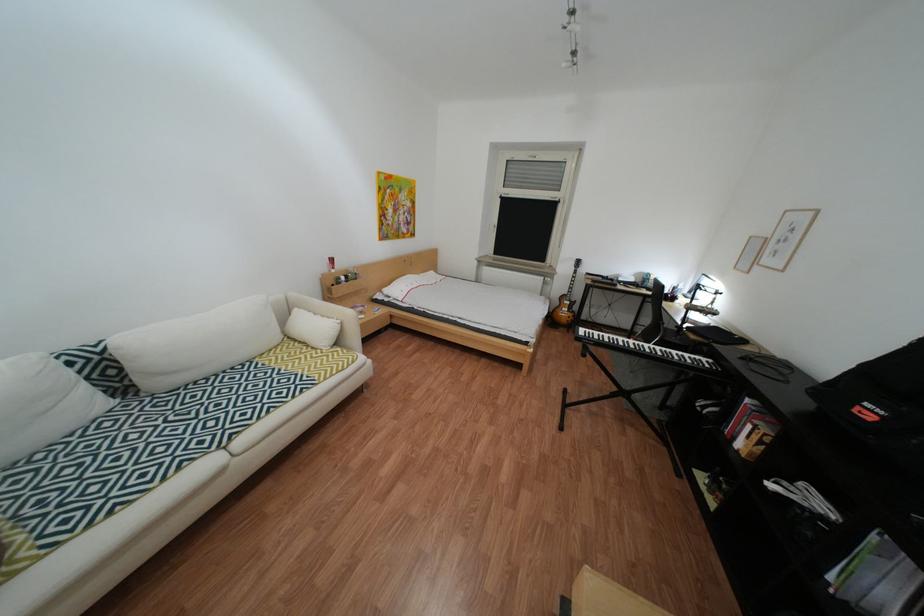
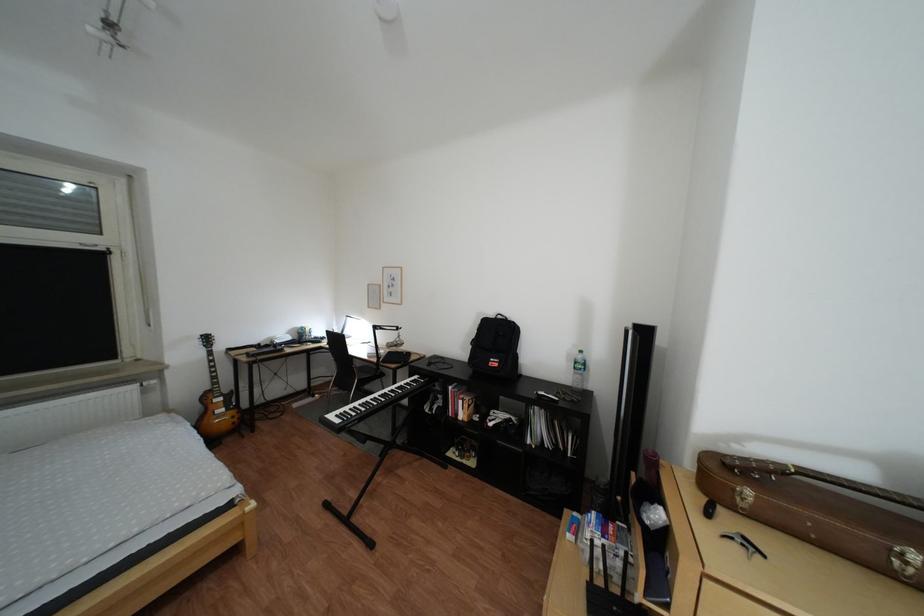
Question: Based on the continuous images, in which direction is the camera rotating? Reply with the corresponding letter.

Choices:
 (A) Left
 (B) Right
 (C) Up
 (D) Down

Answer: (B)